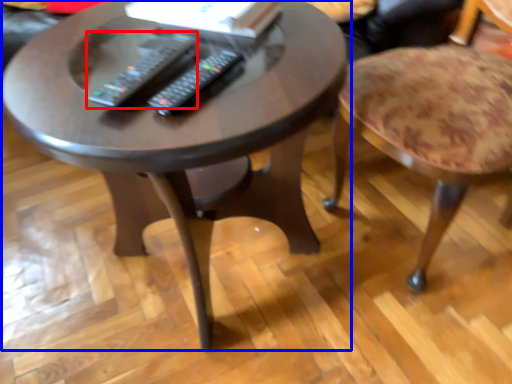
Question: Which object is further to the camera taking this photo, remote (highlighted by a red box) or coffee table (highlighted by a blue box)?

Choices:
 (A) remote
 (B) coffee table

Answer: (A)